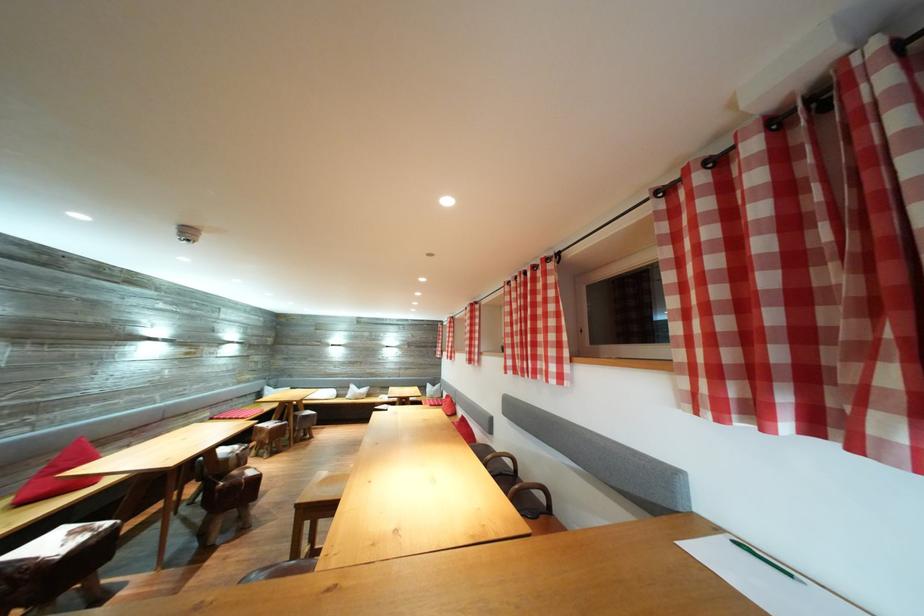
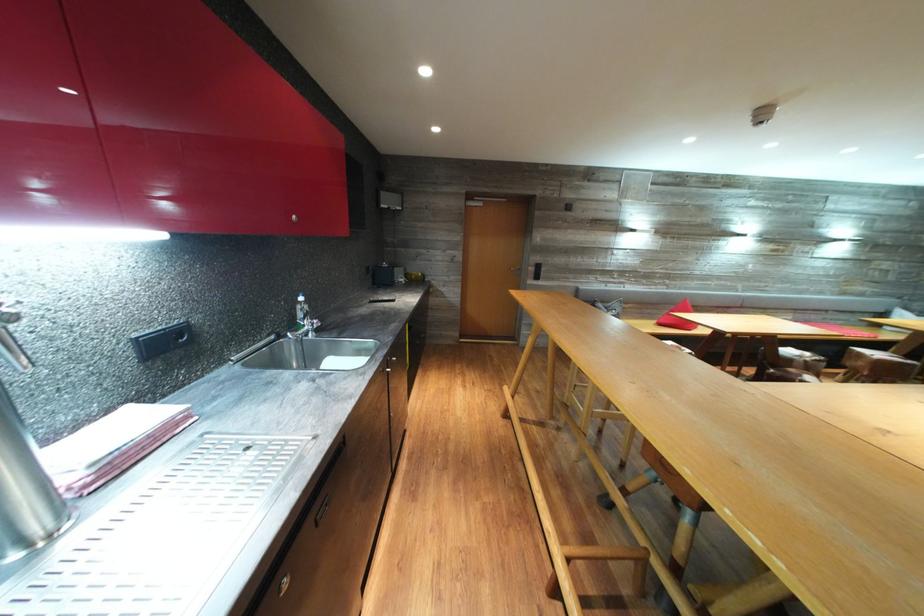
Question: The camera is either moving clockwise (left) or counter-clockwise (right) around the object. The first image is from the beginning of the video and the second image is from the end. Is the camera moving left or right when shooting the video?

Choices:
 (A) Left
 (B) Right

Answer: (B)